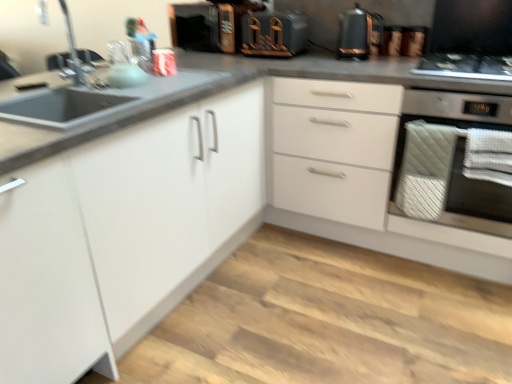
Question: Is metallic copper kettle at upper right bigger or smaller than wooden toaster at upper center?

Choices:
 (A) big
 (B) small

Answer: (B)

Question: Looking at their shapes, would you say metallic copper kettle at upper right is wider or thinner than wooden toaster at upper center?

Choices:
 (A) wide
 (B) thin

Answer: (B)

Question: Considering the real-world distances, which object is farthest from the wooden toaster at upper center?

Choices:
 (A) white matte cabinet at center
 (B) metallic copper kettle at upper right
 (C) white quilted towel at right
 (D) black glass gas stove at upper right
 (E) matte silver faucet at upper left

Answer: (E)

Question: Considering the real-world distances, which object is farthest from the wooden toaster at upper center?

Choices:
 (A) white matte cabinet at center
 (B) white quilted towel at right
 (C) metallic copper kettle at upper right
 (D) matte silver faucet at upper left
 (E) black glass gas stove at upper right

Answer: (D)